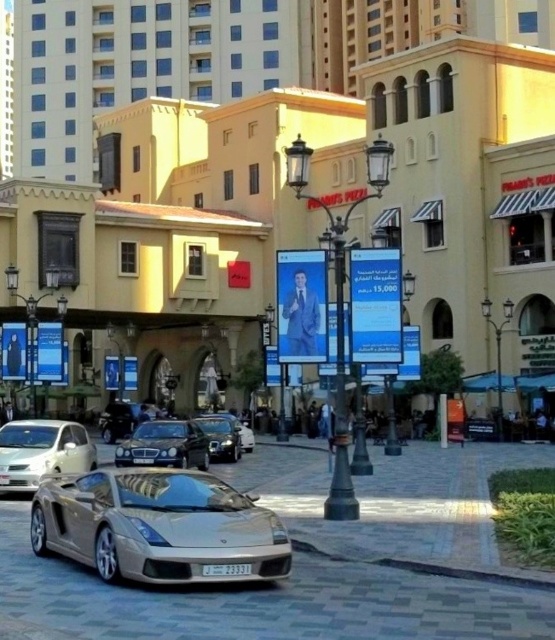
Question: Which point is farther from the camera taking this photo?

Choices:
 (A) (241, 449)
 (B) (115, 456)
 (C) (226, 448)
 (D) (9, 420)

Answer: (D)

Question: In this image, where is white glossy sedan at lower left located relative to silver metallic sports car at center?

Choices:
 (A) right
 (B) left

Answer: (B)

Question: Is shiny silver car at center above silver metallic sports car at center?

Choices:
 (A) no
 (B) yes

Answer: (B)

Question: Which point is closer to the camera taking this photo?

Choices:
 (A) (7, 435)
 (B) (118, 426)
 (C) (508, 74)

Answer: (A)

Question: Is matte yellow building at center wider than shiny silver car at center?

Choices:
 (A) yes
 (B) no

Answer: (A)

Question: Which point appears farthest from the camera in this image?

Choices:
 (A) pyautogui.click(x=52, y=467)
 (B) pyautogui.click(x=239, y=444)
 (C) pyautogui.click(x=512, y=179)

Answer: (C)